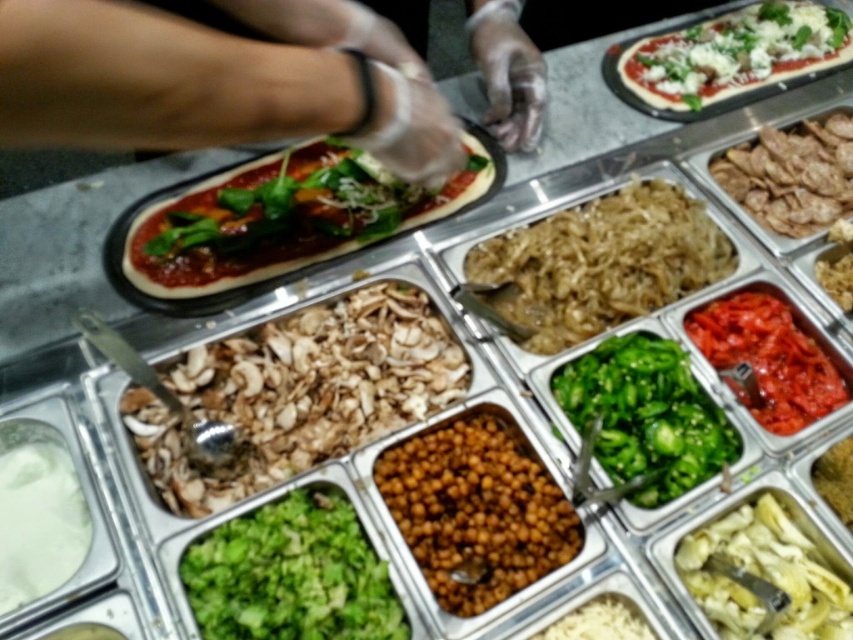
Question: Considering the relative positions of white shelled mushrooms at center and matte green leafy vegetable at center in the image provided, where is white shelled mushrooms at center located with respect to matte green leafy vegetable at center?

Choices:
 (A) below
 (B) above

Answer: (A)

Question: Is green glossy bell pepper at center bigger than white creamy sauce at lower left?

Choices:
 (A) no
 (B) yes

Answer: (B)

Question: Considering the real-world distances, which object is closest to the green glossy bell pepper at center?

Choices:
 (A) brown crispy meat at center right
 (B) green leafymaterial/texture at center

Answer: (B)

Question: Is green leafymaterial/texture at position bigger than brown crumbly topping at center?

Choices:
 (A) yes
 (B) no

Answer: (A)

Question: Which point is closer to the camera?

Choices:
 (A) (779, 572)
 (B) (352, 324)

Answer: (A)

Question: Which object appears farthest from the camera in this image?

Choices:
 (A) brown crispy meat at center right
 (B) clear plastic gloves at center
 (C) white shelled mushrooms at center

Answer: (A)